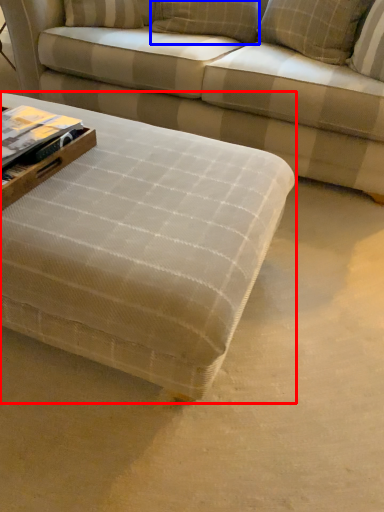
Question: Which object is closer to the camera taking this photo, table (highlighted by a red box) or pillow (highlighted by a blue box)?

Choices:
 (A) table
 (B) pillow

Answer: (A)